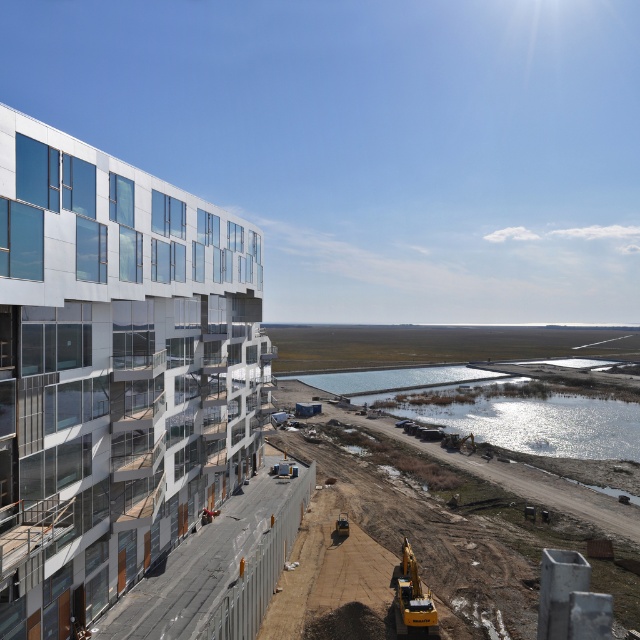
Which of these two, shiny reflective water at lower center or yellow metallic excavator at lower right, stands shorter?

Standing shorter between the two is yellow metallic excavator at lower right.

Does shiny reflective water at lower center have a larger size compared to yellow metallic excavator at lower right?

Yes.

Where is `shiny reflective water at lower center`? This screenshot has height=640, width=640. shiny reflective water at lower center is located at coordinates (524, 417).

Who is positioned more to the left, white glass building at upper left or shiny reflective water at lower center?

Positioned to the left is white glass building at upper left.

Does point (234, 394) come closer to viewer compared to point (472, 420)?

Yes.

I want to click on white glass building at upper left, so click(x=115, y=371).

Does white glass building at upper left appear over yellow metallic excavator at lower right?

Correct, white glass building at upper left is located above yellow metallic excavator at lower right.

Which of these two, white glass building at upper left or yellow metallic excavator at lower right, stands shorter?

yellow metallic excavator at lower right is shorter.

Locate an element on the screen. white glass building at upper left is located at coordinates (115, 371).

Image resolution: width=640 pixels, height=640 pixels. I want to click on white glass building at upper left, so click(x=115, y=371).